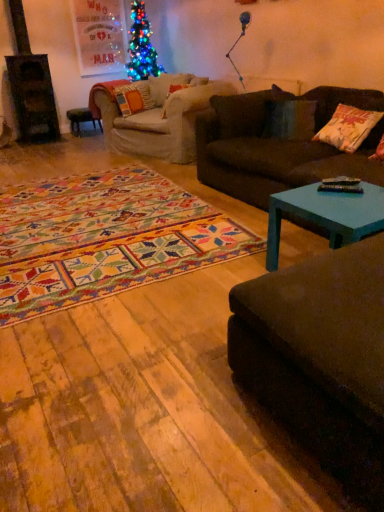
Question: Is velvet dark brown couch at lower right, arranged as the 1th studio couch when viewed from the front, looking in the opposite direction of dark brown fabric couch at center, the second studio couch in the bottom-to-top sequence?

Choices:
 (A) no
 (B) yes

Answer: (A)

Question: Is velvet dark brown couch at lower right, the 2th studio couch when ordered from back to front, positioned far away from dark brown fabric couch at center, the second studio couch in the front-to-back sequence?

Choices:
 (A) no
 (B) yes

Answer: (B)

Question: From the image's perspective, is velvet dark brown couch at lower right, placed as the 1th studio couch when sorted from bottom to top, beneath dark brown fabric couch at center, the second studio couch in the front-to-back sequence?

Choices:
 (A) yes
 (B) no

Answer: (A)

Question: Considering the relative sizes of velvet dark brown couch at lower right, the 2th studio couch in the top-to-bottom sequence, and dark brown fabric couch at center, which is the first studio couch from back to front, in the image provided, is velvet dark brown couch at lower right, the 2th studio couch in the top-to-bottom sequence, shorter than dark brown fabric couch at center, which is the first studio couch from back to front,?

Choices:
 (A) no
 (B) yes

Answer: (B)

Question: Does velvet dark brown couch at lower right, the 2th studio couch when ordered from back to front, lie in front of dark brown fabric couch at center, the second studio couch in the front-to-back sequence?

Choices:
 (A) yes
 (B) no

Answer: (A)

Question: From a real-world perspective, does velvet dark brown couch at lower right, the 2th studio couch when ordered from back to front, stand above dark brown fabric couch at center, which is the first studio couch from back to front?

Choices:
 (A) no
 (B) yes

Answer: (A)

Question: Does velvet orange pillow at center, the 2th pillow viewed from the front, have a greater width compared to dark brown fabric couch at center, which is the first studio couch from back to front?

Choices:
 (A) yes
 (B) no

Answer: (B)

Question: Can you confirm if velvet orange pillow at center, which ranks as the first pillow in left-to-right order, is taller than dark brown fabric couch at center, which is the first studio couch from back to front?

Choices:
 (A) no
 (B) yes

Answer: (A)

Question: Is velvet orange pillow at center, the 2th pillow ordered from the bottom, touching dark brown fabric couch at center, the second studio couch in the front-to-back sequence?

Choices:
 (A) no
 (B) yes

Answer: (A)

Question: Is velvet orange pillow at center, positioned as the first pillow in back-to-front order, looking in the opposite direction of dark brown fabric couch at center, which is the first studio couch from back to front?

Choices:
 (A) yes
 (B) no

Answer: (B)

Question: Can you confirm if velvet orange pillow at center, which ranks as the first pillow in left-to-right order, is positioned to the right of dark brown fabric couch at center, the 1th studio couch from the top?

Choices:
 (A) yes
 (B) no

Answer: (B)

Question: Does velvet orange pillow at center, which ranks as the first pillow in left-to-right order, turn towards dark brown fabric couch at center, the second studio couch in the bottom-to-top sequence?

Choices:
 (A) yes
 (B) no

Answer: (A)

Question: Considering the relative positions of teal painted wood coffee table at lower right and white cotton pillow at right, acting as the first pillow starting from the front, in the image provided, is teal painted wood coffee table at lower right to the right of white cotton pillow at right, acting as the first pillow starting from the front, from the viewer's perspective?

Choices:
 (A) yes
 (B) no

Answer: (B)